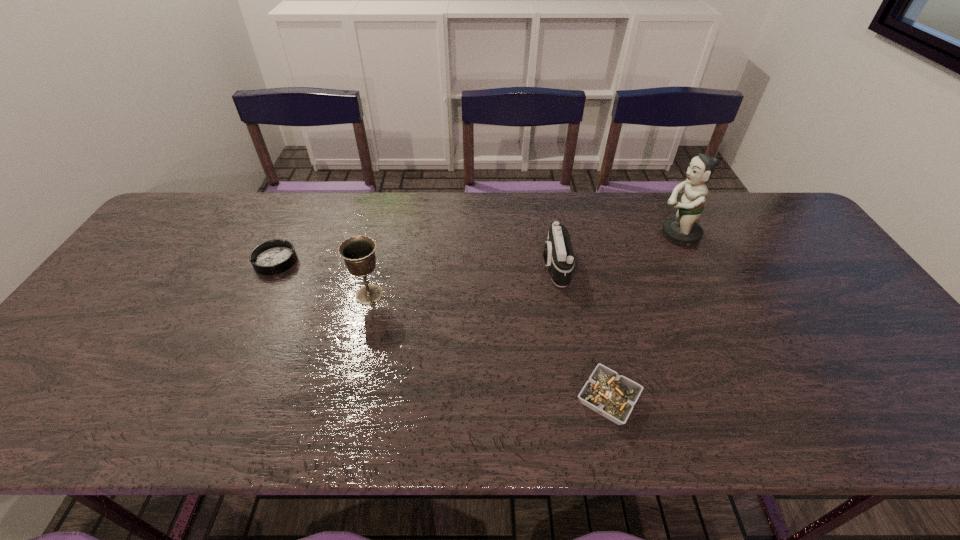
Where is `empty location between the second tallest object and the farther ashtray`? The image size is (960, 540). empty location between the second tallest object and the farther ashtray is located at coordinates (323, 278).

This screenshot has height=540, width=960. Find the location of `free space between the left ashtray and the rightmost object`. free space between the left ashtray and the rightmost object is located at coordinates (477, 248).

Find the location of a particular element. Image resolution: width=960 pixels, height=540 pixels. vacant region between the nearer ashtray and the chalice is located at coordinates (489, 347).

Where is `vacant area that lies between the nearer ashtray and the farther ashtray`? This screenshot has width=960, height=540. vacant area that lies between the nearer ashtray and the farther ashtray is located at coordinates (442, 330).

Where is `the second closest object to the second object from left to right`? the second closest object to the second object from left to right is located at coordinates (558, 254).

Find the location of a particular element. object that is the third closest to the rightmost object is located at coordinates click(x=358, y=252).

This screenshot has width=960, height=540. Find the location of `vacant space that satisfies the following two spatial constraints: 1. on the front lens of the right ashtray; 2. on the left side of the camera`. vacant space that satisfies the following two spatial constraints: 1. on the front lens of the right ashtray; 2. on the left side of the camera is located at coordinates (577, 400).

At what (x,y) coordinates should I click in order to perform the action: click on free space that satisfies the following two spatial constraints: 1. on the front side of the fourth shortest object; 2. on the right side of the nearer ashtray. Please return your answer as a coordinate pair (x, y). The image size is (960, 540). Looking at the image, I should click on (344, 400).

Find the location of a particular element. The image size is (960, 540). free space that satisfies the following two spatial constraints: 1. on the front lens of the nearer ashtray; 2. on the right side of the camera is located at coordinates (577, 400).